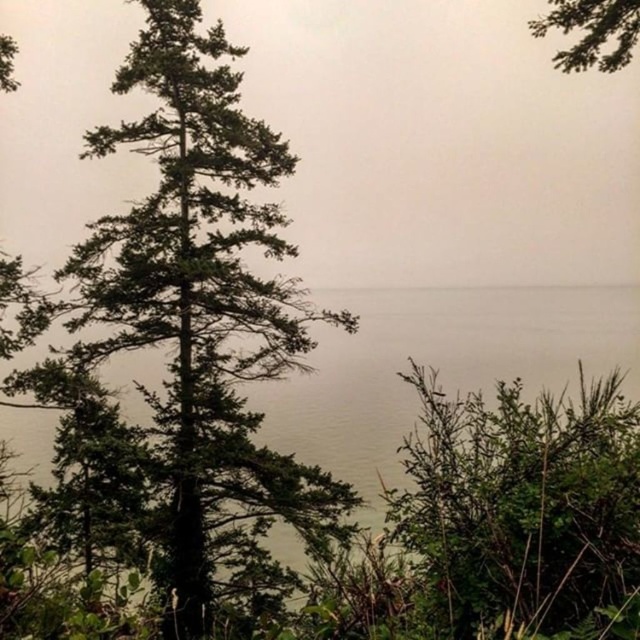
Consider the image. Which is more to the left, green leafy bush at lower right or greenish water at center?

Positioned to the left is green leafy bush at lower right.

Who is more distant from viewer, (435, 403) or (456, 330)?

The point (456, 330) is more distant.

What do you see at coordinates (520, 502) in the screenshot? This screenshot has height=640, width=640. I see `green leafy bush at lower right` at bounding box center [520, 502].

Image resolution: width=640 pixels, height=640 pixels. I want to click on green leafy bush at lower right, so click(x=520, y=502).

Does green needle-like foliage at center-left have a larger size compared to green matte tree at upper right?

No, green needle-like foliage at center-left is not bigger than green matte tree at upper right.

Identify the location of green needle-like foliage at center-left. This screenshot has width=640, height=640. (186, 339).

Which is behind, point (172, 273) or point (541, 317)?

The point (541, 317) is more distant.

Does green needle-like foliage at center-left appear on the left side of greenish water at center?

Correct, you'll find green needle-like foliage at center-left to the left of greenish water at center.

Does point (211, 401) come in front of point (616, 289)?

Yes, point (211, 401) is closer to viewer.

Where is `green needle-like foliage at center-left`? Image resolution: width=640 pixels, height=640 pixels. green needle-like foliage at center-left is located at coordinates (186, 339).